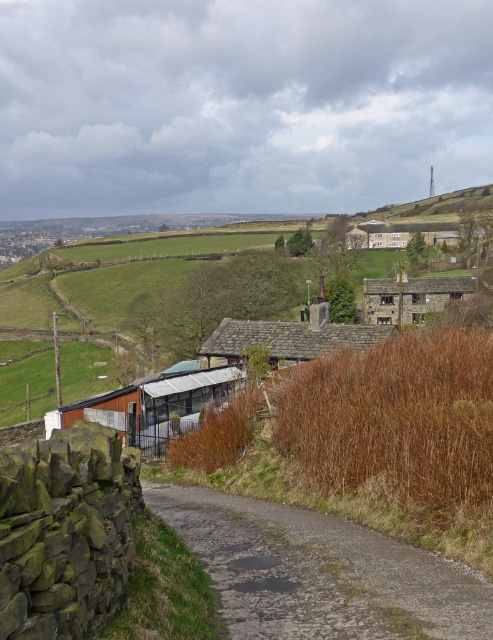
This screenshot has height=640, width=493. Find the location of `gray asphalt road at center`. gray asphalt road at center is located at coordinates (318, 572).

Which is in front, point (285, 582) or point (379, 326)?

Positioned in front is point (285, 582).

Is point (454, 589) less distant than point (293, 333)?

Yes, point (454, 589) is closer to viewer.

Image resolution: width=493 pixels, height=640 pixels. I want to click on gray asphalt road at center, so click(x=318, y=572).

Is brown corrugated metal hut at lower center taller than rustic stone house at upper right?

In fact, brown corrugated metal hut at lower center may be shorter than rustic stone house at upper right.

Is point (211, 387) farther from camera compared to point (386, 292)?

No, (211, 387) is closer to viewer.

Who is more forward, (85, 419) or (375, 288)?

Positioned in front is point (85, 419).

At what (x,y) coordinates should I click in order to perform the action: click on brown corrugated metal hut at lower center. Please return your answer as a coordinate pair (x, y). Looking at the image, I should click on (152, 404).

Who is lower down, brown corrugated metal hut at lower center or gray slate roof at center?

Positioned lower is brown corrugated metal hut at lower center.

Does brown corrugated metal hut at lower center appear on the left side of gray slate roof at center?

Correct, you'll find brown corrugated metal hut at lower center to the left of gray slate roof at center.

You are a GUI agent. You are given a task and a screenshot of the screen. Output one action in this format:
    pyautogui.click(x=<x>, y=<y>)
    Task: Click on the brown corrugated metal hut at lower center
    Image resolution: width=493 pixels, height=640 pixels.
    Given the screenshot: What is the action you would take?
    click(152, 404)